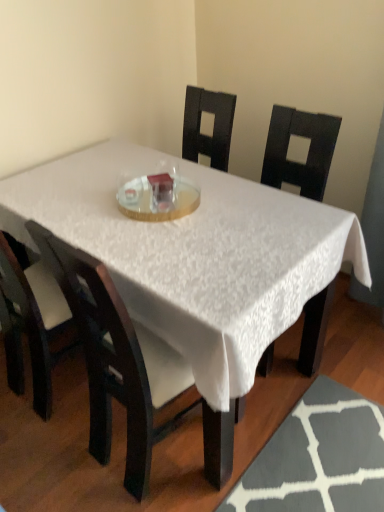
At what (x,y) coordinates should I click in order to perform the action: click on free point in front of matte black chair at center, which is the 1th chair from left to right. Please return your answer as a coordinate pair (x, y). Looking at the image, I should click on (44, 454).